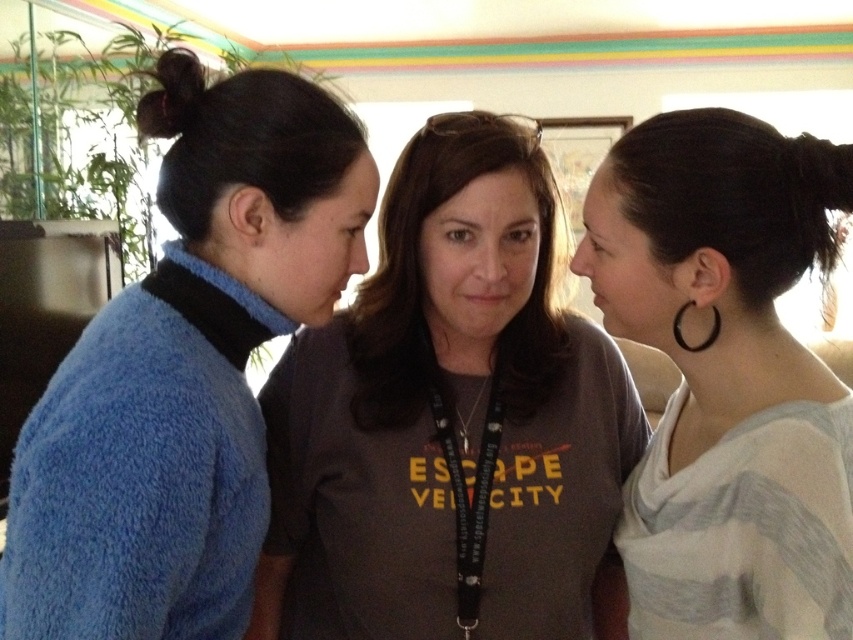
Does point (392, 314) come closer to viewer compared to point (727, 196)?

No.

Who is more forward, (285,406) or (664,588)?

Point (664,588) is in front.

Is point (352, 346) more distant than point (840, 608)?

Yes.

At what (x,y) coordinates should I click in order to perform the action: click on dark gray t-shirt at center. Please return your answer as a coordinate pair (x, y). Image resolution: width=853 pixels, height=640 pixels. Looking at the image, I should click on (447, 416).

Is dark gray t-shirt at center shorter than black rubber hoop at right?

No.

Is dark gray t-shirt at center further to camera compared to black rubber hoop at right?

That is True.

Is point (376, 582) positioned in front of point (706, 339)?

No, (376, 582) is behind (706, 339).

You are a GUI agent. You are given a task and a screenshot of the screen. Output one action in this format:
    pyautogui.click(x=<x>, y=<y>)
    Task: Click on the dark gray t-shirt at center
    
    Given the screenshot: What is the action you would take?
    pyautogui.click(x=447, y=416)

Who is lower down, dark gray t-shirt at center or blue fuzzy sweater at left?

Positioned lower is dark gray t-shirt at center.

Does dark gray t-shirt at center appear on the right side of blue fuzzy sweater at left?

Indeed, dark gray t-shirt at center is positioned on the right side of blue fuzzy sweater at left.

Locate an element on the screen. dark gray t-shirt at center is located at coordinates (447, 416).

Locate an element on the screen. The image size is (853, 640). dark gray t-shirt at center is located at coordinates pyautogui.click(x=447, y=416).